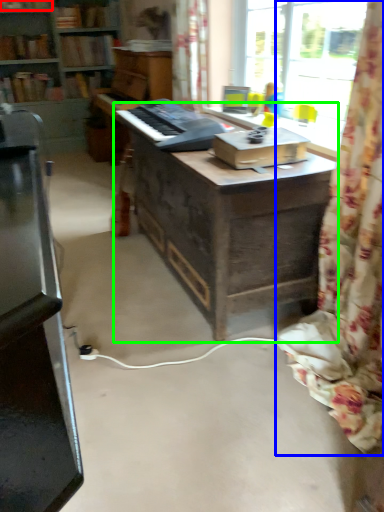
Question: Estimate the real-world distances between objects in this image. Which object is closer to book (highlighted by a red box), curtain (highlighted by a blue box) or table (highlighted by a green box)?

Choices:
 (A) curtain
 (B) table

Answer: (B)